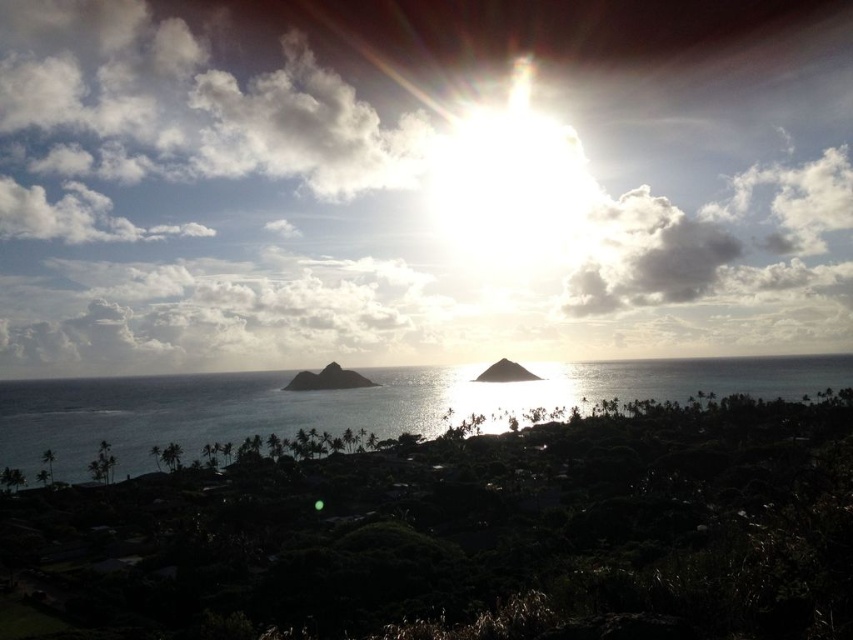
Does point (158, 426) come in front of point (341, 371)?

Yes, it is.

Between point (451, 365) and point (309, 388), which one is positioned in front?

Point (309, 388) is more forward.

Which is in front, point (140, 419) or point (367, 381)?

Point (140, 419) is in front.

The width and height of the screenshot is (853, 640). Identify the location of clear blue water at center. (351, 403).

Does clear blue water at center have a greater height compared to dark brown soil at center?

Correct, clear blue water at center is much taller as dark brown soil at center.

Identify the location of clear blue water at center. (351, 403).

In the scene shown: Is smooth rock island at center to the left of dark brown soil at center from the viewer's perspective?

Correct, you'll find smooth rock island at center to the left of dark brown soil at center.

Between point (314, 380) and point (509, 371), which one is positioned in front?

Point (314, 380) is in front.

This screenshot has height=640, width=853. I want to click on smooth rock island at center, so click(328, 380).